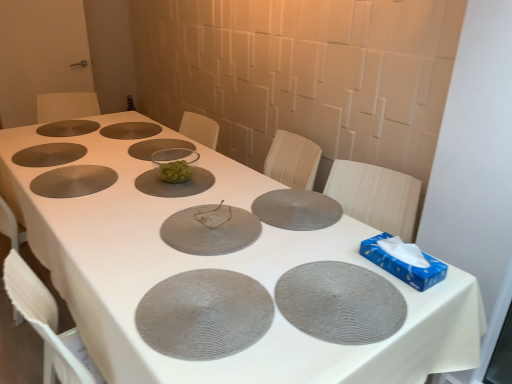
In order to click on free area in between matte gray placemat at left, which appears as the fifth glass plate when viewed from the front, and transparent glass bowl at center, arranged as the 8th glass plate when viewed from the front in this screenshot , I will do pyautogui.click(x=111, y=159).